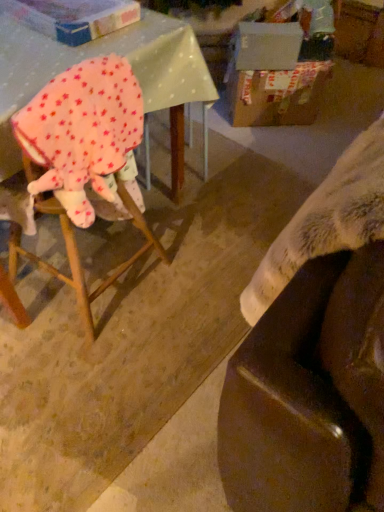
At what (x,y) coordinates should I click in order to perform the action: click on spots to the right of cardboard box at upper right, which is the first cardboard box from right to left. Please return your answer as a coordinate pair (x, y). Looking at the image, I should click on (331, 120).